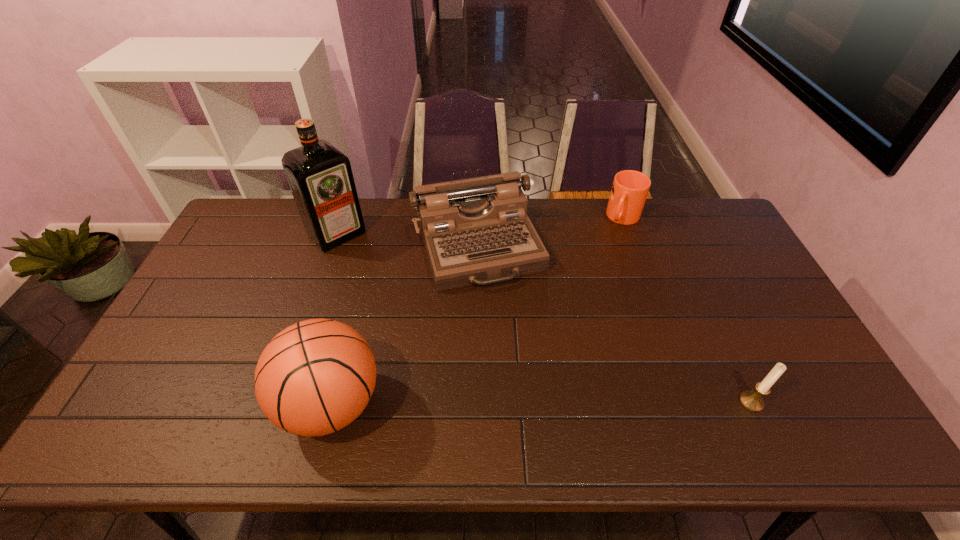
Locate an element on the screen. vacant space on the desktop that is between the basketball and the candle holder and is positioned on the keyboard of the third tallest object is located at coordinates (540, 403).

Identify the location of free space on the desktop that is between the fourth shortest object and the candle holder and is positioned on the front label of the tallest object. The width and height of the screenshot is (960, 540). (502, 403).

Identify the location of vacant space on the desktop that is between the basketball and the candle holder and is positioned on the handle side of the mug. The image size is (960, 540). (535, 403).